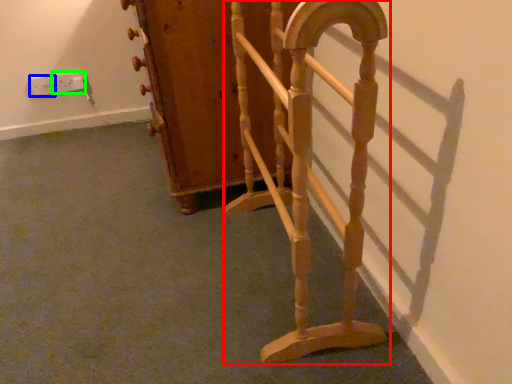
Question: Based on their relative distances, which object is farther from furniture (highlighted by a red box)? Choose from electric outlet (highlighted by a blue box) and electric outlet (highlighted by a green box).

Choices:
 (A) electric outlet
 (B) electric outlet

Answer: (A)